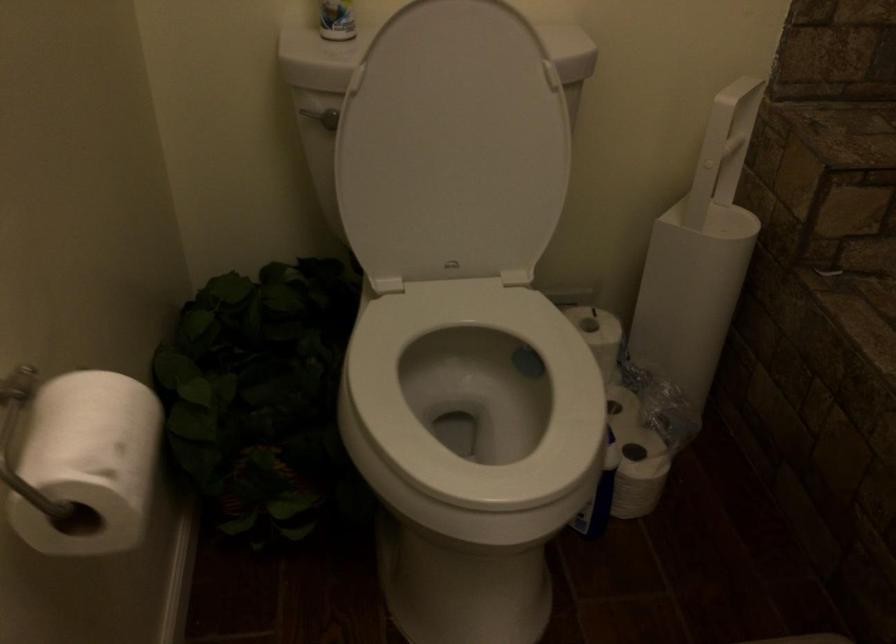
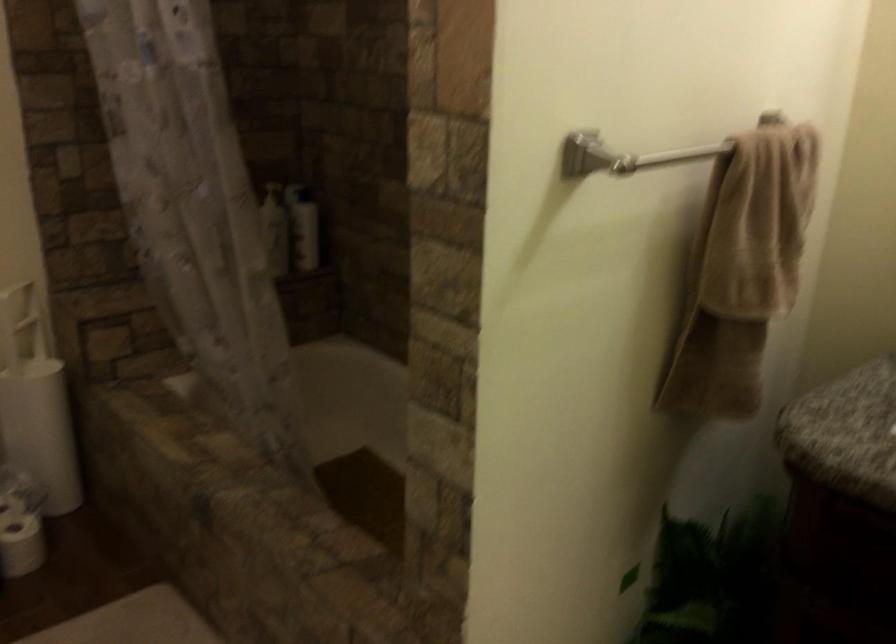
Locate, in the second image, the point that corresponds to [635,453] in the first image.

(20, 524)